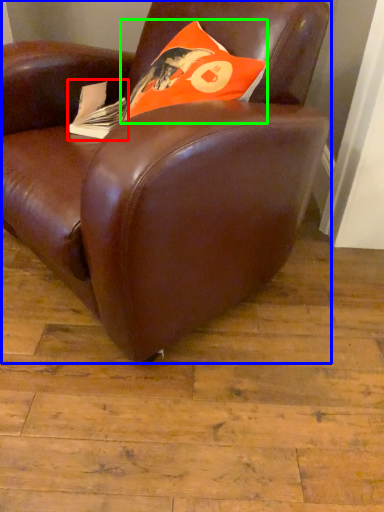
Question: Estimate the real-world distances between objects in this image. Which object is closer to paperback book (highlighted by a red box), chair (highlighted by a blue box) or throw pillow (highlighted by a green box)?

Choices:
 (A) chair
 (B) throw pillow

Answer: (B)